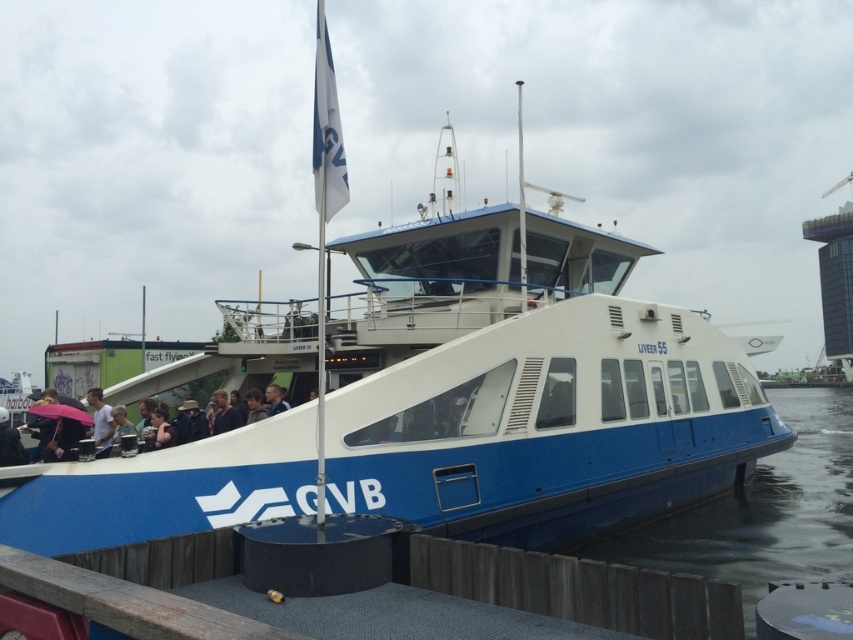
Can you confirm if blue rubber boat at lower center is taller than light blue shirt at lower left?

Indeed, blue rubber boat at lower center has a greater height compared to light blue shirt at lower left.

Does blue rubber boat at lower center appear on the right side of light blue shirt at lower left?

Indeed, blue rubber boat at lower center is positioned on the right side of light blue shirt at lower left.

Does point (785, 413) lie behind point (93, 432)?

Yes.

Locate an element on the screen. blue rubber boat at lower center is located at coordinates (764, 512).

In the scene shown: Does blue matte boat at center lie behind blue rubber boat at lower center?

Yes, it is behind blue rubber boat at lower center.

Can you confirm if blue matte boat at center is shorter than blue rubber boat at lower center?

Correct, blue matte boat at center is not as tall as blue rubber boat at lower center.

Between point (3, 484) and point (706, 548), which one is positioned in front?

Point (3, 484) is in front.

At what (x,y) coordinates should I click in order to perform the action: click on blue matte boat at center. Please return your answer as a coordinate pair (x, y). Looking at the image, I should click on (456, 406).

Does point (370, 468) come in front of point (105, 426)?

Yes.

The image size is (853, 640). In order to click on blue matte boat at center in this screenshot , I will do `click(456, 406)`.